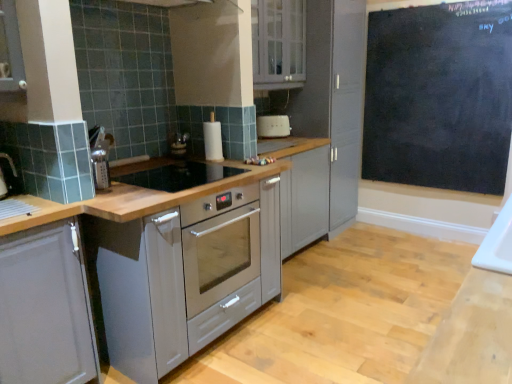
Question: Can you confirm if white glossy cabinet at upper center, which is the 1th cabinetry in top-to-bottom order, is positioned to the left of black glass gas stove at center?

Choices:
 (A) yes
 (B) no

Answer: (B)

Question: Can you confirm if white glossy cabinet at upper center, the 2th cabinetry from the bottom, is thinner than black glass gas stove at center?

Choices:
 (A) no
 (B) yes

Answer: (B)

Question: Considering the relative positions of white glossy cabinet at upper center, the 2th cabinetry from the bottom, and black glass gas stove at center in the image provided, is white glossy cabinet at upper center, the 2th cabinetry from the bottom, to the right of black glass gas stove at center from the viewer's perspective?

Choices:
 (A) yes
 (B) no

Answer: (A)

Question: Considering the relative sizes of white glossy cabinet at upper center, which is the second cabinetry from left to right, and black glass gas stove at center in the image provided, is white glossy cabinet at upper center, which is the second cabinetry from left to right, taller than black glass gas stove at center?

Choices:
 (A) no
 (B) yes

Answer: (B)

Question: Is white glossy cabinet at upper center, the second cabinetry positioned from the front, positioned in front of black glass gas stove at center?

Choices:
 (A) yes
 (B) no

Answer: (B)

Question: From a real-world perspective, is white glossy cabinet at upper center, the second cabinetry positioned from the front, located beneath black glass gas stove at center?

Choices:
 (A) no
 (B) yes

Answer: (A)

Question: From a real-world perspective, is black glass gas stove at center located beneath black chalkboard at upper right?

Choices:
 (A) no
 (B) yes

Answer: (B)

Question: Is black glass gas stove at center touching black chalkboard at upper right?

Choices:
 (A) yes
 (B) no

Answer: (B)

Question: Is black glass gas stove at center bigger than black chalkboard at upper right?

Choices:
 (A) no
 (B) yes

Answer: (A)

Question: Does black glass gas stove at center have a lesser height compared to black chalkboard at upper right?

Choices:
 (A) yes
 (B) no

Answer: (A)

Question: Would you say black glass gas stove at center is outside black chalkboard at upper right?

Choices:
 (A) no
 (B) yes

Answer: (B)

Question: Considering the relative sizes of black glass gas stove at center and black chalkboard at upper right in the image provided, is black glass gas stove at center wider than black chalkboard at upper right?

Choices:
 (A) yes
 (B) no

Answer: (A)

Question: Is matte gray cabinet at left, the 2th cabinetry when ordered from top to bottom, at the left side of white glossy cabinet at upper center, the 2th cabinetry from the bottom?

Choices:
 (A) no
 (B) yes

Answer: (B)